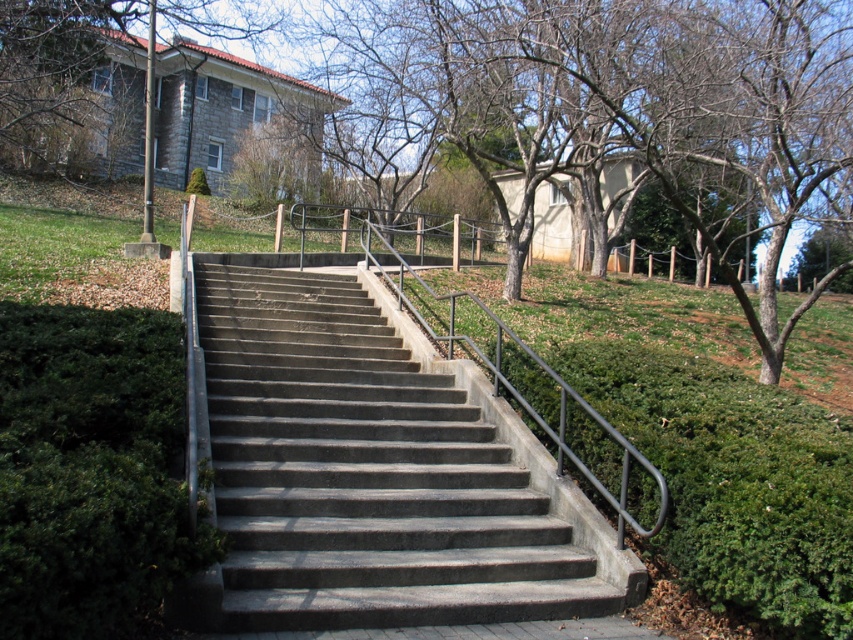
Question: Can you confirm if bare branches at center is positioned above green stone building at upper left?

Choices:
 (A) no
 (B) yes

Answer: (A)

Question: Which point is farther to the camera?

Choices:
 (A) concrete/steps at center
 (B) green leafy bush at lower left
 (C) green stone building at upper left
 (D) bare branches at center

Answer: (C)

Question: Can you confirm if concrete/steps at center is positioned below bare branches at center?

Choices:
 (A) yes
 (B) no

Answer: (A)

Question: Does bare branches at center have a larger size compared to green stone building at upper left?

Choices:
 (A) no
 (B) yes

Answer: (B)

Question: Which object is the closest to the bare branches at center?

Choices:
 (A) green stone building at upper left
 (B) concrete/steps at center

Answer: (B)

Question: Estimate the real-world distances between objects in this image. Which object is closer to the green stone building at upper left?

Choices:
 (A) bare branches at center
 (B) concrete/steps at center
 (C) green leafy bush at lower left

Answer: (A)